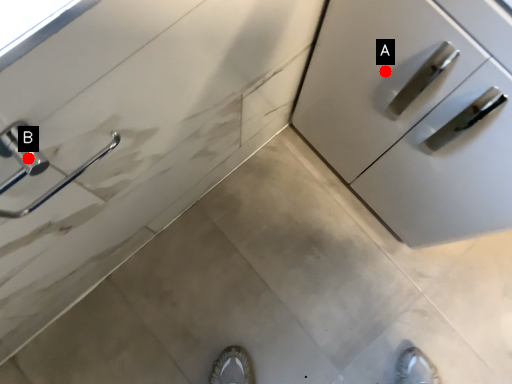
Question: Two points are circled on the image, labeled by A and B beside each circle. Which point appears farthest from the camera in this image?

Choices:
 (A) A is further
 (B) B is further

Answer: (A)